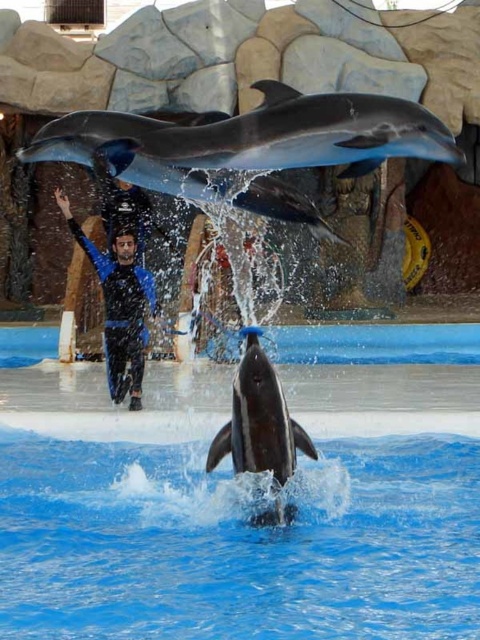
You are a trainer observing the dolphin show. You notice the smooth gray dolphin at center and the blue rubber suit at center. Which object is narrower in width?

The smooth gray dolphin at center has a lesser width compared to the blue rubber suit at center, so the smooth gray dolphin at center is narrower.

You are a photographer positioned at the edge of the pool. You want to take a photo of the smooth gray dolphin at center and the blue rubber suit at center. Which object will appear larger in your photo?

The smooth gray dolphin at center will appear larger in the photo because it is closer to the viewer than the blue rubber suit at center.